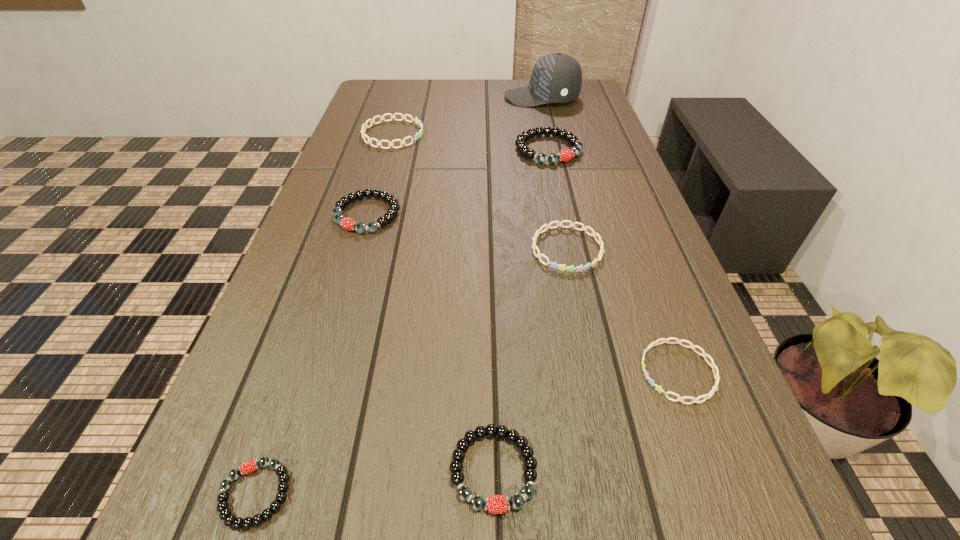
Find the location of a particular element. blank space at the left edge of the desktop is located at coordinates (377, 149).

At what (x,y) coordinates should I click in order to perform the action: click on free region at the right edge. Please return your answer as a coordinate pair (x, y). Looking at the image, I should click on (682, 316).

In order to click on vacant space at the far left corner of the desktop in this screenshot , I will do `click(372, 96)`.

The width and height of the screenshot is (960, 540). I want to click on blank region between the smallest blue bracelet and the baseball cap, so click(x=610, y=235).

Where is `unoccupied area between the second black bracelet from right to left and the tallest object`? Image resolution: width=960 pixels, height=540 pixels. unoccupied area between the second black bracelet from right to left and the tallest object is located at coordinates (517, 284).

This screenshot has width=960, height=540. What are the coordinates of `free space that is in between the third black bracelet from left to right and the biggest blue bracelet` in the screenshot? It's located at (443, 302).

Where is `vacant point located between the seventh shortest object and the leftmost blue bracelet`? This screenshot has height=540, width=960. vacant point located between the seventh shortest object and the leftmost blue bracelet is located at coordinates (470, 142).

Locate an element on the screen. The width and height of the screenshot is (960, 540). empty space between the third nearest black bracelet and the second biggest blue bracelet is located at coordinates (468, 232).

Identify which object is the second nearest to the smallest blue bracelet. Please provide its 2D coordinates. Your answer should be formatted as a tuple, i.e. [(x, y)], where the tuple contains the x and y coordinates of a point satisfying the conditions above.

[(497, 504)]

Point out which object is positioned as the seventh nearest to the smallest black bracelet. Please provide its 2D coordinates. Your answer should be formatted as a tuple, i.e. [(x, y)], where the tuple contains the x and y coordinates of a point satisfying the conditions above.

[(556, 78)]